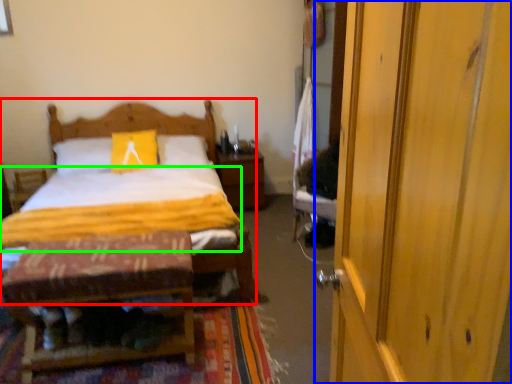
Question: Which is farther away from bed (highlighted by a red box)? door (highlighted by a blue box) or quilt (highlighted by a green box)?

Choices:
 (A) door
 (B) quilt

Answer: (A)